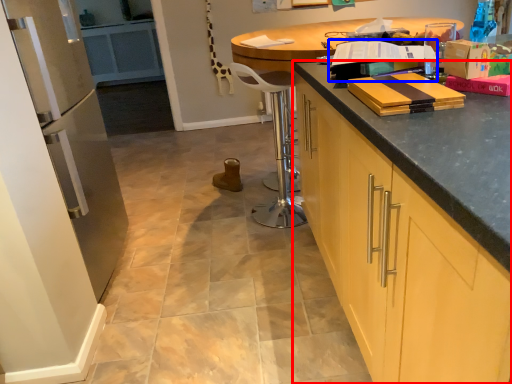
Question: Which object appears closest to the camera in this image, cabinetry (highlighted by a red box) or book (highlighted by a blue box)?

Choices:
 (A) cabinetry
 (B) book

Answer: (A)